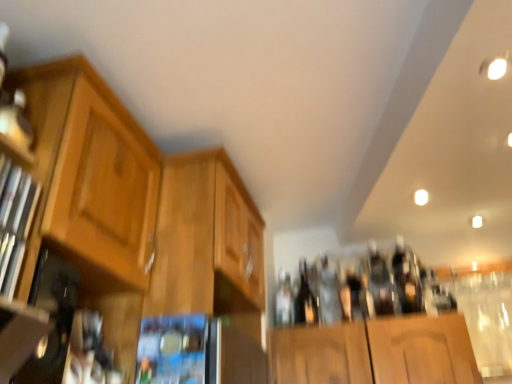
Question: From the image's perspective, is black glass beer bottle at center located above or below clear glass bottle at center, the second bottle in the left-to-right sequence?

Choices:
 (A) below
 (B) above

Answer: (A)

Question: Considering the positions of point (301, 274) and point (348, 284), is point (301, 274) closer or farther from the camera than point (348, 284)?

Choices:
 (A) closer
 (B) farther

Answer: (B)

Question: Considering the real-world distances, which object is closest to the clear glass bottle at center, the 1th bottle when ordered from left to right?

Choices:
 (A) light brown wood cabinet at left, which ranks as the second cabinetry in right-to-left order
 (B) clear glass bottle at center, which is the first bottle from right to left
 (C) black glass beer bottle at center
 (D) wooden cabinet at center, the first cabinetry positioned from the right
 (E) metallic silver microwave at center

Answer: (C)

Question: Estimate the real-world distances between objects in this image. Which object is closer to the wooden cabinet at left?

Choices:
 (A) wooden cabinet at center, which ranks as the second cabinetry in left-to-right order
 (B) black glass beer bottle at center
 (C) clear glass bottle at center, the second bottle in the left-to-right sequence
 (D) light brown wood cabinet at left, the 1th cabinetry positioned from the left
 (E) clear glass bottle at center, which ranks as the 2th bottle in right-to-left order

Answer: (D)